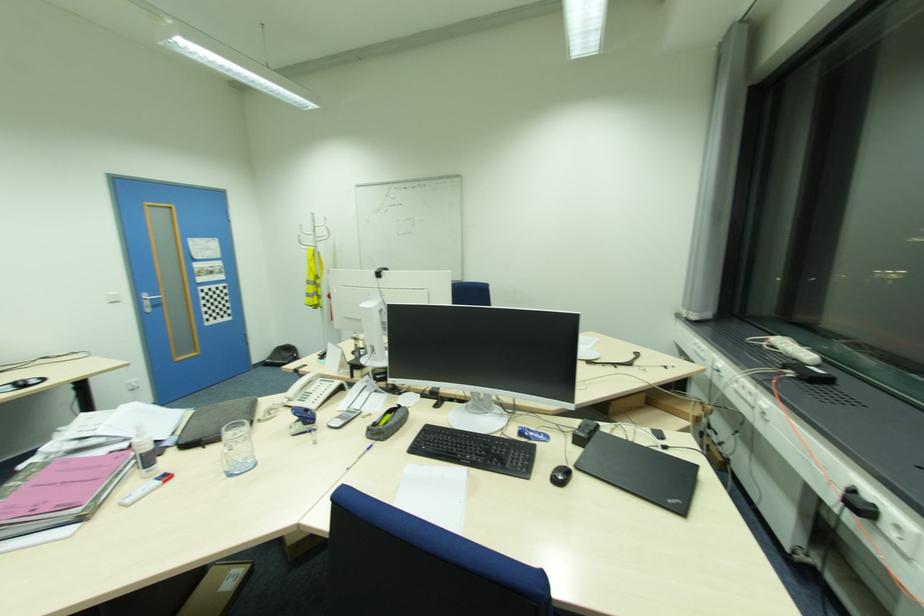
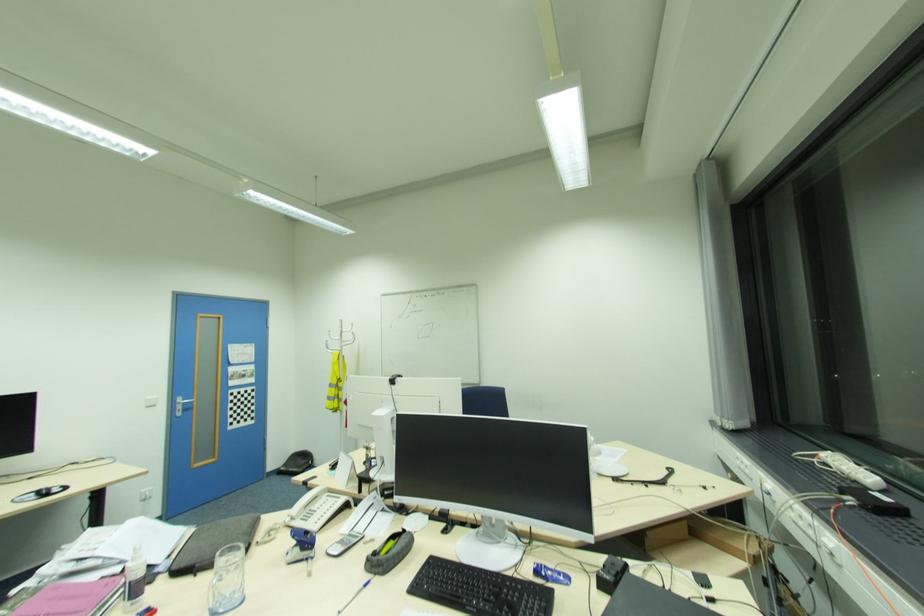
Locate, in the second image, the point that corresponds to the point at 371,448 in the first image.

(369, 585)